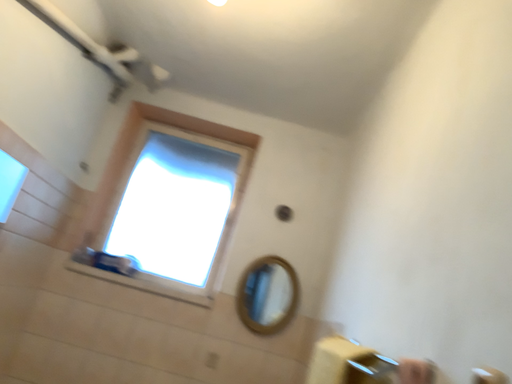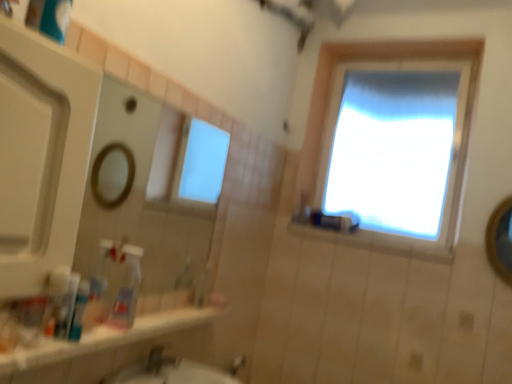
Question: Which way did the camera rotate in the video?

Choices:
 (A) rotated right
 (B) rotated left

Answer: (B)